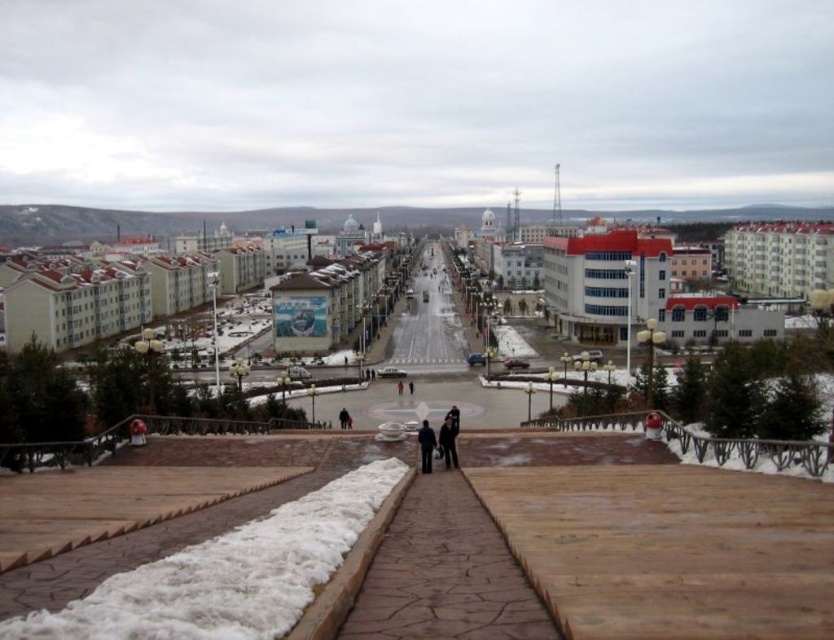
You are standing on the elevated platform looking down at the urban scene. There are two points marked in the image, point 1 at coordinates [168,554] and point 2 at [446,436]. Which point is closer to your current position?

Point 1 at coordinates [168,554] is closer to your current position because it is closer to the camera than point 2 at [446,436].

You are a fashion designer observing two jackets displayed on mannequins in the middle of an urban scene. Which jacket is taller? The jackets are the black leather jacket at center and the dark blue jacket at center.

The black leather jacket at center is taller than the dark blue jacket at center according to the description.